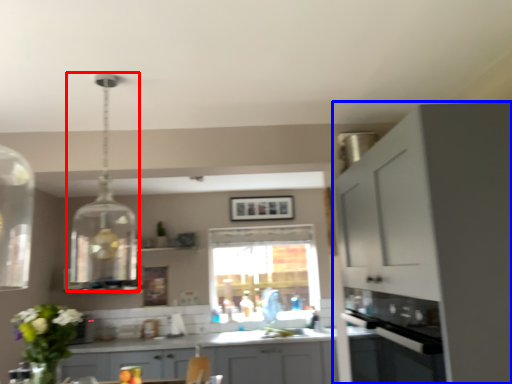
Question: Which object is further to the camera taking this photo, light fixture (highlighted by a red box) or cabinetry (highlighted by a blue box)?

Choices:
 (A) light fixture
 (B) cabinetry

Answer: (A)